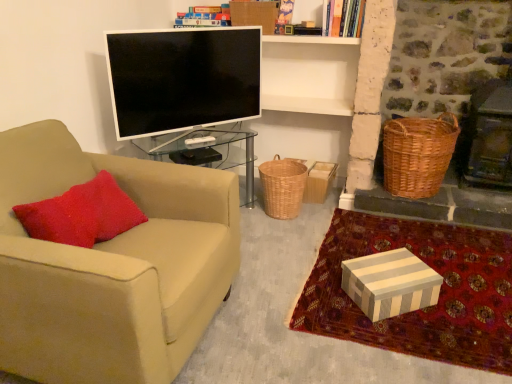
Question: From the image's perspective, would you say beige fabric chair at left is positioned over woven brown picnic basket at right?

Choices:
 (A) no
 (B) yes

Answer: (A)

Question: Can you confirm if beige fabric chair at left is bigger than woven brown picnic basket at right?

Choices:
 (A) no
 (B) yes

Answer: (B)

Question: Does beige fabric chair at left appear on the left side of woven brown picnic basket at right?

Choices:
 (A) yes
 (B) no

Answer: (A)

Question: From the image's perspective, does beige fabric chair at left appear lower than woven brown picnic basket at right?

Choices:
 (A) yes
 (B) no

Answer: (A)

Question: Is beige fabric chair at left not near woven brown picnic basket at right?

Choices:
 (A) yes
 (B) no

Answer: (A)

Question: From a real-world perspective, relative to white striped fabric at lower right, is woven brown picnic basket at right vertically above or below?

Choices:
 (A) above
 (B) below

Answer: (A)

Question: Is woven brown picnic basket at right bigger or smaller than white striped fabric at lower right?

Choices:
 (A) small
 (B) big

Answer: (B)

Question: Is point (457, 132) closer or farther from the camera than point (337, 309)?

Choices:
 (A) farther
 (B) closer

Answer: (A)

Question: Is woven brown picnic basket at right situated inside white striped fabric at lower right or outside?

Choices:
 (A) outside
 (B) inside

Answer: (A)

Question: Is woven brown picnic basket at right inside or outside of hardcover book at upper center?

Choices:
 (A) outside
 (B) inside

Answer: (A)

Question: Is woven brown picnic basket at right to the left or to the right of hardcover book at upper center in the image?

Choices:
 (A) left
 (B) right

Answer: (B)

Question: Considering the positions of point (384, 175) and point (338, 16), is point (384, 175) closer or farther from the camera than point (338, 16)?

Choices:
 (A) closer
 (B) farther

Answer: (B)

Question: From a real-world perspective, is woven brown picnic basket at right above or below hardcover book at upper center?

Choices:
 (A) above
 (B) below

Answer: (B)

Question: From the image's perspective, relative to striped cardboard box at lower right, is woven brown basket at center above or below?

Choices:
 (A) below
 (B) above

Answer: (B)

Question: Considering the positions of woven brown basket at center and striped cardboard box at lower right in the image, is woven brown basket at center taller or shorter than striped cardboard box at lower right?

Choices:
 (A) short
 (B) tall

Answer: (B)